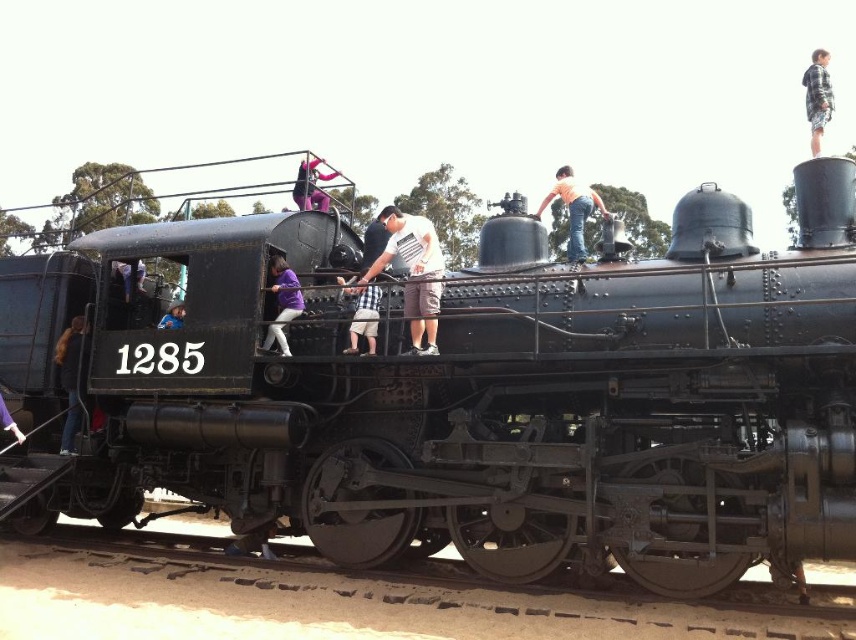
Question: Does plaid shirt at upper right have a larger size compared to checkered fabric shorts at center?

Choices:
 (A) yes
 (B) no

Answer: (A)

Question: Can you confirm if white cotton shirt at center is positioned above dark brown leather jacket at lower left?

Choices:
 (A) no
 (B) yes

Answer: (B)

Question: Estimate the real-world distances between objects in this image. Which object is closer to the orange shirt at upper center?

Choices:
 (A) dark brown leather jacket at lower left
 (B) brushed metal jacket at left
 (C) purple matte shirt at center
 (D) matte black locomotive at center

Answer: (C)

Question: Does metal/rough train track at lower center appear on the right side of purple fabric pants at lower left?

Choices:
 (A) no
 (B) yes

Answer: (B)

Question: Among these objects, which one is farthest from the camera?

Choices:
 (A) purple fabric at upper center
 (B) purple fabric pants at lower left
 (C) plaid shirt at upper right
 (D) blue denim jeans at lower left

Answer: (A)

Question: Which of the following is the closest to the observer?

Choices:
 (A) purple matte shirt at center
 (B) brushed metal jacket at left
 (C) blue denim jeans at lower left

Answer: (A)